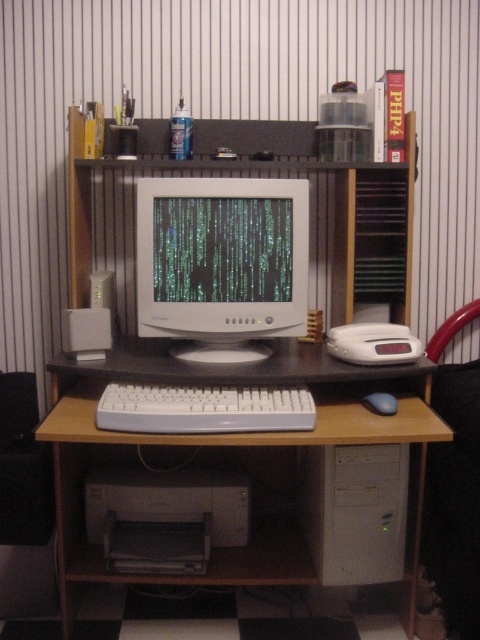
You are setting up a new keyboard for a computer desk. The white glossy monitor at center is already placed. The white plastic keyboard at center needs to be positioned so that it is exactly 12 inches away from the monitor. Based on the current setup, is the keyboard too close or too far?

The distance between the white glossy monitor at center and the white plastic keyboard at center is 11.48 inches, which is slightly less than 12 inches. Therefore, the keyboard is too close and needs to be moved further away to meet the required distance.

You are setting up a new computer tower and need to place it on the desk. Based on the scene, can the white plastic computer tower at lower center fit on the white plastic computer desk at center?

The white plastic computer desk at center has a larger size compared to the white plastic computer tower at lower center, so yes, the white plastic computer tower at lower center can fit on the white plastic computer desk at center since it is smaller in size.